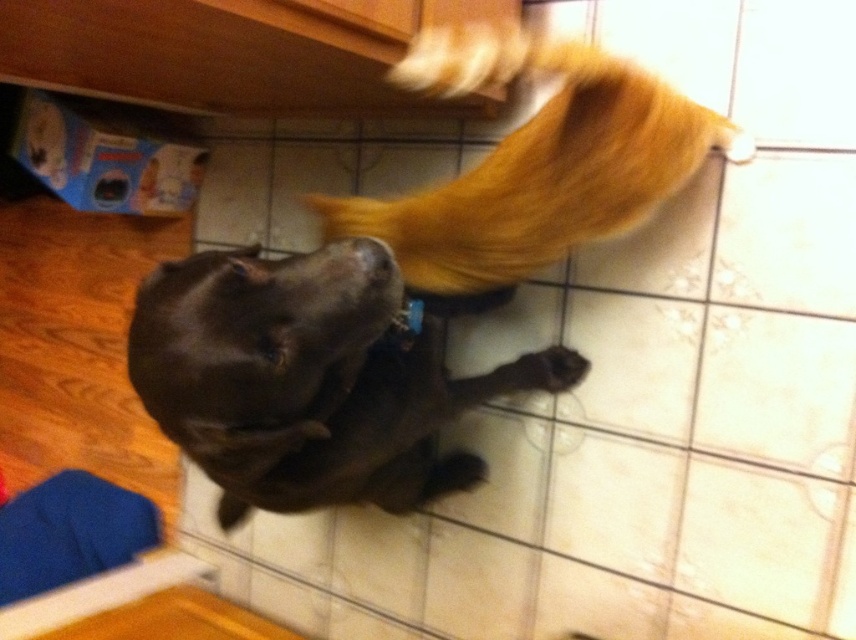
Question: Which object appears closest to the camera in this image?

Choices:
 (A) shiny brown dog at center
 (B) brown fur paw at lower center
 (C) brown fur dog at upper center

Answer: (A)

Question: Which is nearer to the white glossy tile at lower right?

Choices:
 (A) brown fur paw at lower center
 (B) brown fur dog at upper center

Answer: (A)

Question: Where is shiny brown dog at center located in relation to brown fur dog at upper center in the image?

Choices:
 (A) below
 (B) above

Answer: (A)

Question: Which object is closer to the camera taking this photo?

Choices:
 (A) white glossy tile at lower right
 (B) brown fur dog at upper center
 (C) brown fur paw at lower center

Answer: (B)

Question: Is brown fur dog at upper center to the right of white glossy tile at lower right from the viewer's perspective?

Choices:
 (A) no
 (B) yes

Answer: (A)

Question: Can you confirm if shiny brown dog at center is positioned to the left of white glossy tile at lower right?

Choices:
 (A) yes
 (B) no

Answer: (A)